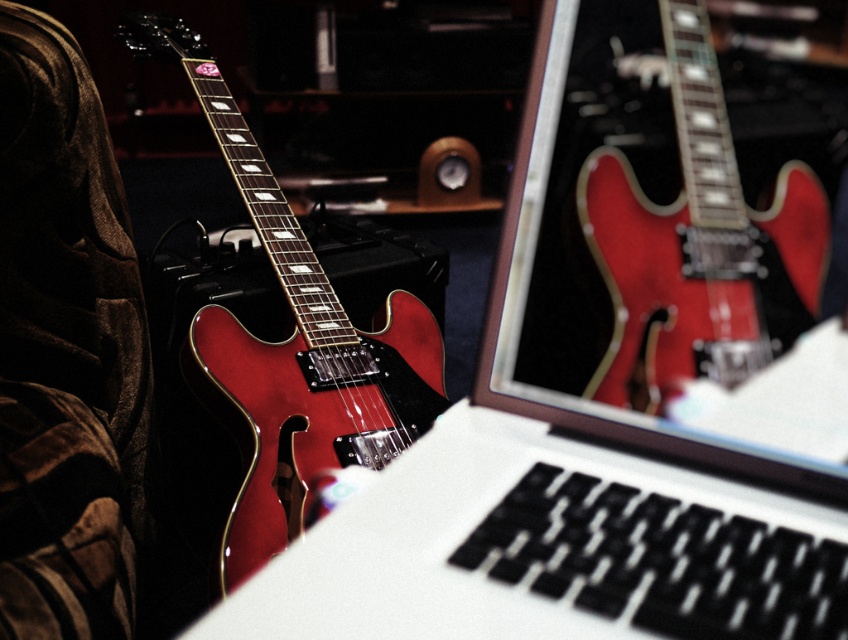
Question: Can you confirm if glossy red electric guitar at center is positioned to the right of glossy red guitar at left?

Choices:
 (A) no
 (B) yes

Answer: (B)

Question: Is glossy red electric guitar at center above glossy red guitar at left?

Choices:
 (A) no
 (B) yes

Answer: (A)

Question: Which point is closer to the camera?

Choices:
 (A) (330, 412)
 (B) (603, 228)

Answer: (B)

Question: Can you confirm if glossy red electric guitar at center is bigger than glossy red guitar at left?

Choices:
 (A) no
 (B) yes

Answer: (A)

Question: Among these objects, which one is nearest to the camera?

Choices:
 (A) glossy red guitar at left
 (B) glossy red electric guitar at center

Answer: (B)